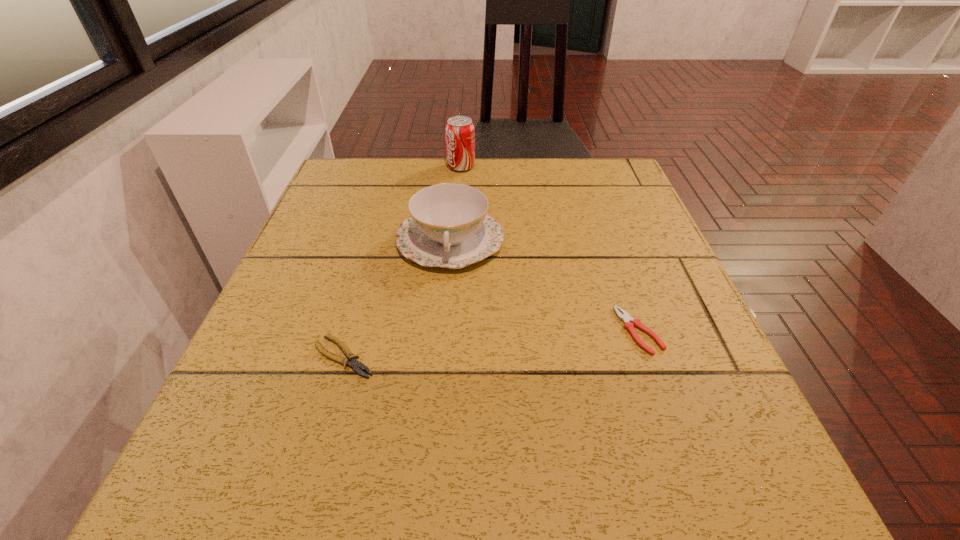
Where is `blank region between the third nearest object and the rightmost object`? The image size is (960, 540). blank region between the third nearest object and the rightmost object is located at coordinates (544, 286).

This screenshot has height=540, width=960. I want to click on blank region between the soda and the rightmost object, so click(x=550, y=249).

Where is `vacant space that's between the soda and the right pliers`? The width and height of the screenshot is (960, 540). vacant space that's between the soda and the right pliers is located at coordinates (550, 249).

Where is `vacant area between the third shortest object and the left pliers`? vacant area between the third shortest object and the left pliers is located at coordinates (397, 299).

You are a GUI agent. You are given a task and a screenshot of the screen. Output one action in this format:
    pyautogui.click(x=<x>, y=<y>)
    Task: Click on the unoccupied area between the rightmost object and the third nearest object
    
    Given the screenshot: What is the action you would take?
    pyautogui.click(x=544, y=286)

Identify the location of free space between the tallest object and the rightmost object. (550, 249).

Locate an element on the screen. This screenshot has height=540, width=960. vacant space that's between the rightmost object and the left pliers is located at coordinates click(x=492, y=344).

At what (x,y) coordinates should I click in order to perform the action: click on object that is the closest to the right pliers. Please return your answer as a coordinate pair (x, y). This screenshot has width=960, height=540. Looking at the image, I should click on (449, 226).

Identify which object is located as the third nearest to the chinaware. Please provide its 2D coordinates. Your answer should be formatted as a tuple, i.e. [(x, y)], where the tuple contains the x and y coordinates of a point satisfying the conditions above.

[(629, 323)]

You are a GUI agent. You are given a task and a screenshot of the screen. Output one action in this format:
    pyautogui.click(x=<x>, y=<y>)
    Task: Click on the free spot that satisfies the following two spatial constraints: 1. on the handle side of the second tallest object; 2. on the right side of the rightmost object
    The height and width of the screenshot is (540, 960).
    Given the screenshot: What is the action you would take?
    pyautogui.click(x=443, y=331)